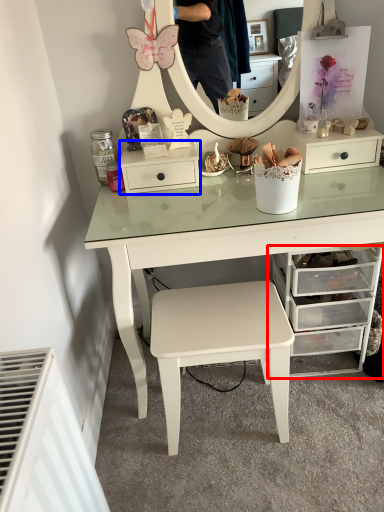
Question: Which point is closer to the camera, chest of drawers (highlighted by a red box) or nightstand (highlighted by a blue box)?

Choices:
 (A) chest of drawers
 (B) nightstand

Answer: (A)